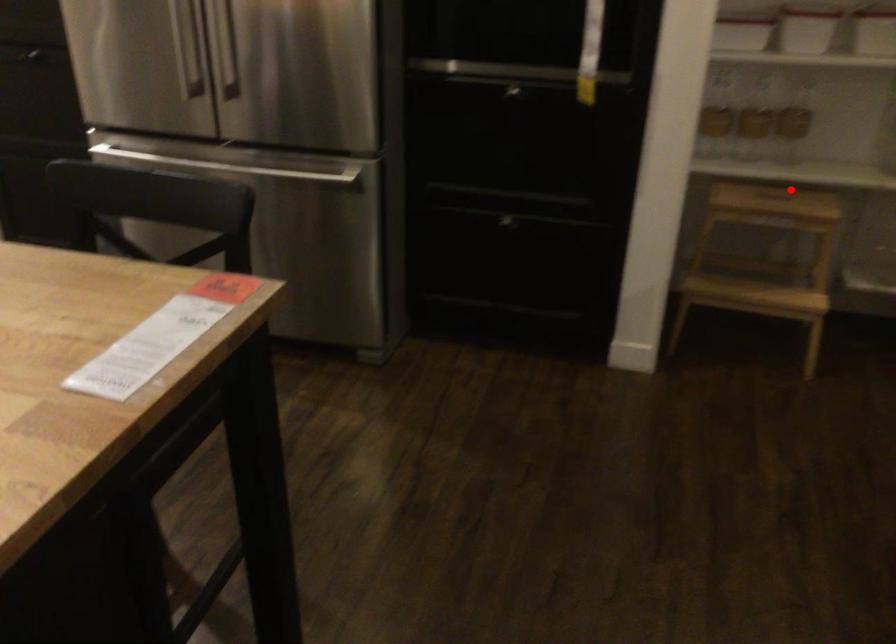
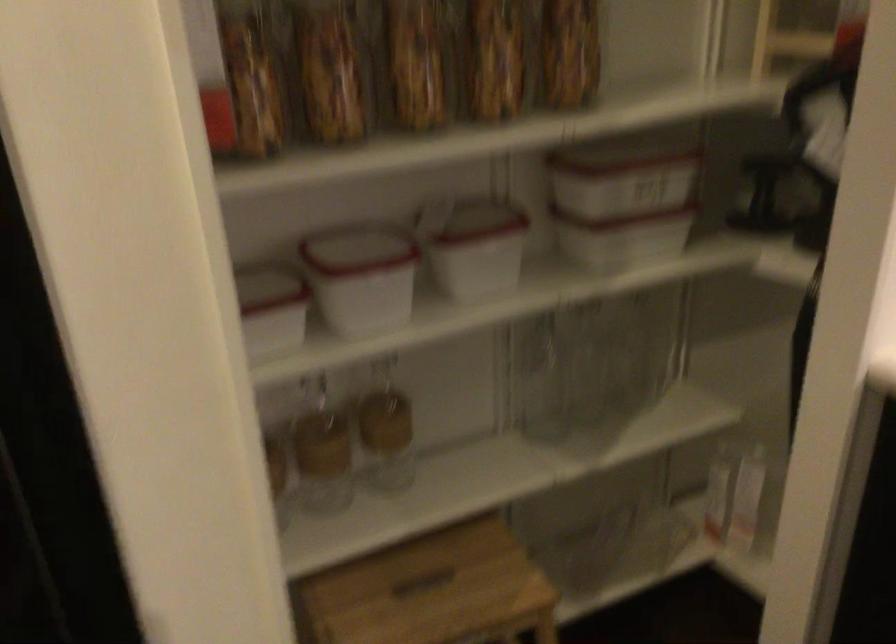
The point at the highlighted location is marked in the first image. Where is the corresponding point in the second image?

(428, 565)